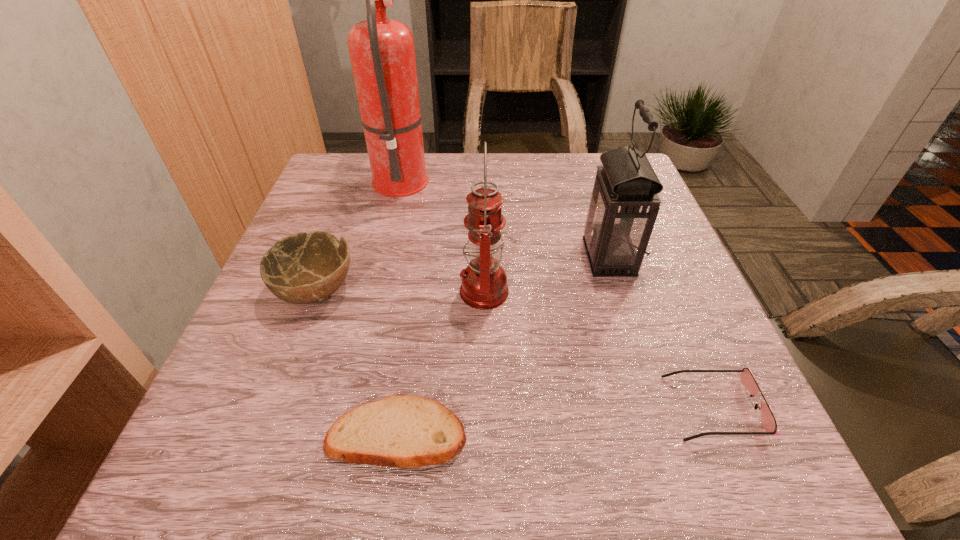
At what (x,y) coordinates should I click in order to perform the action: click on the tallest object. Please return your answer as a coordinate pair (x, y). Looking at the image, I should click on (382, 53).

This screenshot has width=960, height=540. Identify the location of fire extinguisher. (382, 53).

At what (x,y) coordinates should I click in order to perform the action: click on lantern. Please return your answer as a coordinate pair (x, y). The height and width of the screenshot is (540, 960). Looking at the image, I should click on (624, 204).

The height and width of the screenshot is (540, 960). I want to click on oil lamp, so click(484, 286).

This screenshot has height=540, width=960. I want to click on bowl, so click(x=302, y=268).

Find the location of a particular element. sunglasses is located at coordinates pyautogui.click(x=768, y=423).

The image size is (960, 540). Find the location of `pita bread`. pita bread is located at coordinates (403, 431).

Where is `free location located with the handle and hose on the tallest object`? Image resolution: width=960 pixels, height=540 pixels. free location located with the handle and hose on the tallest object is located at coordinates (562, 177).

You are a GUI agent. You are given a task and a screenshot of the screen. Output one action in this format:
    pyautogui.click(x=<x>, y=<y>)
    Task: Click on the free space located on the front-facing side of the lantern
    Image resolution: width=960 pixels, height=540 pixels.
    Given the screenshot: What is the action you would take?
    pyautogui.click(x=555, y=257)

This screenshot has width=960, height=540. Identify the location of vacant area situated on the front-facing side of the lantern. (527, 257).